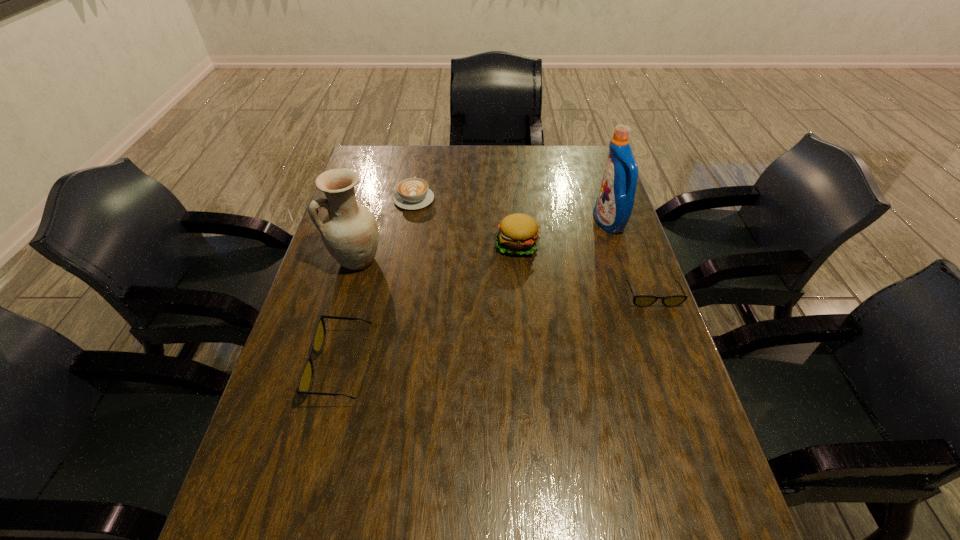
To make them evenly spaced by inserting another sunglasses among them, please locate a free space for this new sunglasses. Please provide its 2D coordinates. Your answer should be formatted as a tuple, i.e. [(x, y)], where the tuple contains the x and y coordinates of a point satisfying the conditions above.

[(508, 329)]